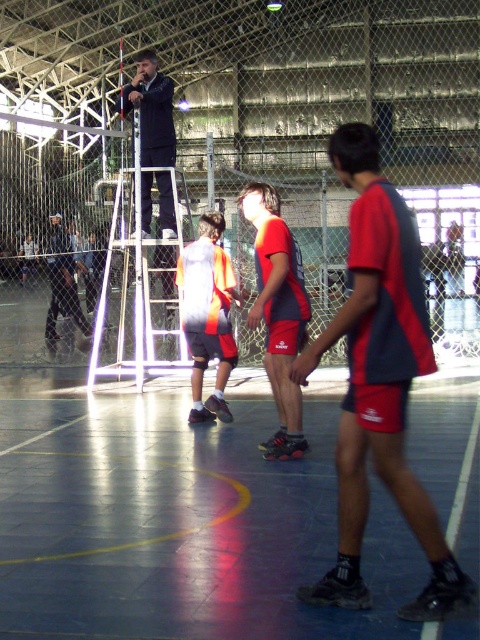
You are a GUI agent. You are given a task and a screenshot of the screen. Output one action in this format:
    pyautogui.click(x=<x>, y=<y>)
    Task: Click on the red fabric shorts at center
    The width and height of the screenshot is (480, 640).
    Given the screenshot: What is the action you would take?
    pyautogui.click(x=380, y=384)

Is point (356, 241) in front of point (158, 120)?

Yes, it is.

Locate an element on the screen. This screenshot has width=480, height=640. red fabric shorts at center is located at coordinates (380, 384).

You are a GUI agent. You are given a task and a screenshot of the screen. Output one action in this format:
    pyautogui.click(x=<x>, y=<y>)
    Task: Click on the red fabric shorts at center
    The height and width of the screenshot is (640, 480).
    Given the screenshot: What is the action you would take?
    pyautogui.click(x=380, y=384)

Can you confirm if red fabric shorts at center is thinner than dark gray pants at left?

Yes, red fabric shorts at center is thinner than dark gray pants at left.

Between red fabric shorts at center and dark gray pants at left, which one is positioned higher?

dark gray pants at left is above.

Describe the element at coordinates (380, 384) in the screenshot. I see `red fabric shorts at center` at that location.

Locate an element on the screen. red fabric shorts at center is located at coordinates (380, 384).

Does matte red shorts at center have a greater height compared to dark gray pants at left?

Indeed, matte red shorts at center has a greater height compared to dark gray pants at left.

Does point (251, 196) come farther from viewer compared to point (60, 262)?

That is False.

Where is `matte red shorts at center`? The width and height of the screenshot is (480, 640). matte red shorts at center is located at coordinates (277, 312).